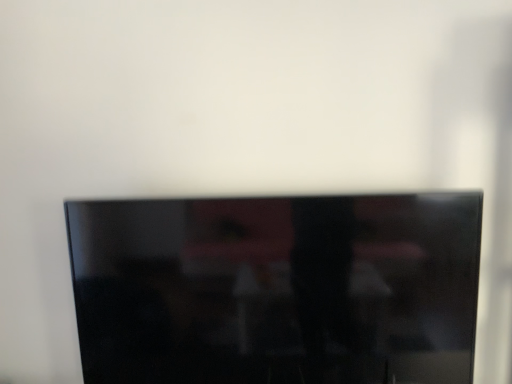
Question: Should I look upward or downward to see matte black tv at center?

Choices:
 (A) down
 (B) up

Answer: (A)